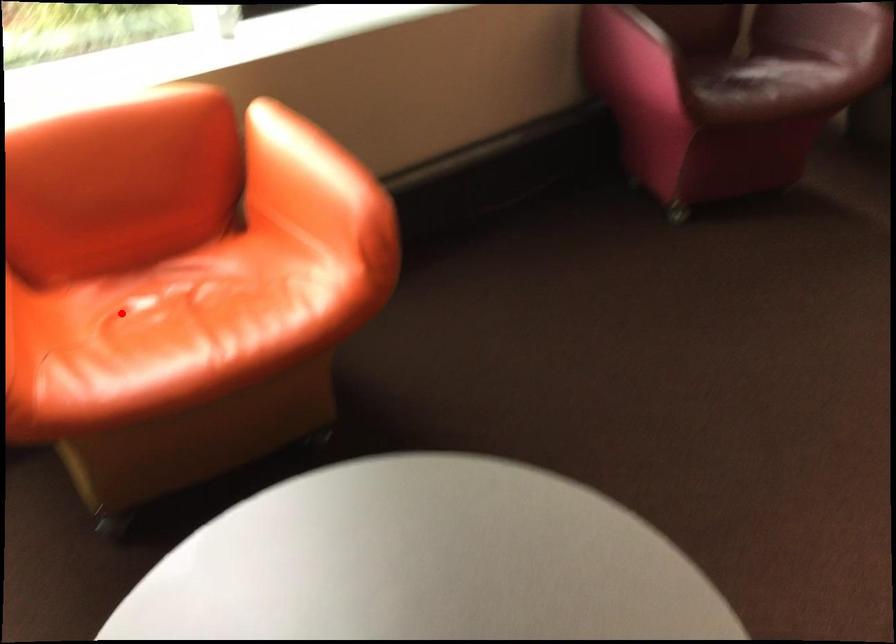
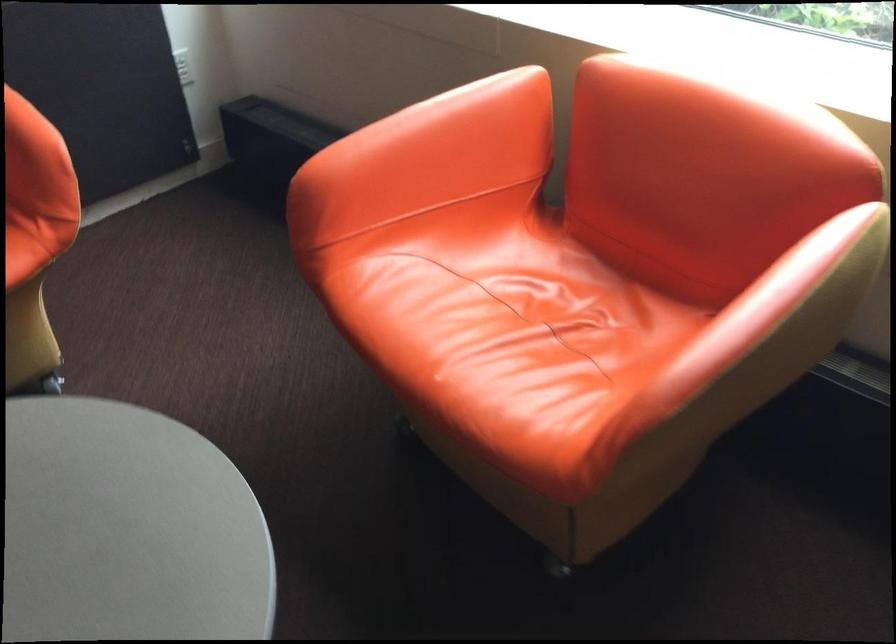
Question: I am providing you with two images of the same scene from different viewpoints. Image1 has a red point marked. In image2, the corresponding 3D location appears at what relative position? Reply with the corresponding letter.

Choices:
 (A) Closer
 (B) Farther

Answer: (A)